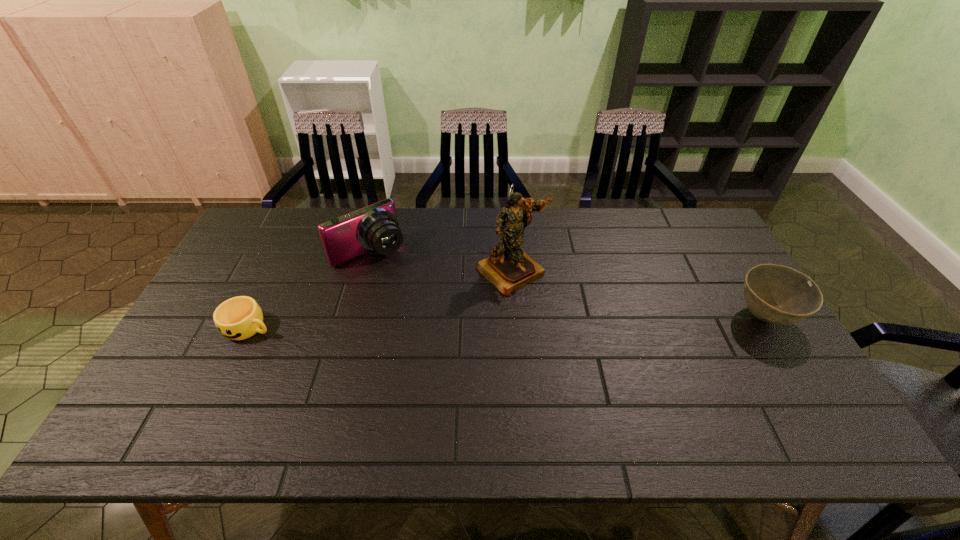
Locate an element on the screen. The height and width of the screenshot is (540, 960). the shortest object is located at coordinates (238, 318).

The width and height of the screenshot is (960, 540). I want to click on the leftmost object, so click(238, 318).

Locate an element on the screen. bowl is located at coordinates (775, 294).

Find the location of `the third tallest object`. the third tallest object is located at coordinates (775, 294).

This screenshot has width=960, height=540. What are the coordinates of `the second object from right to left` in the screenshot? It's located at (509, 268).

Where is `the tallest object`? The width and height of the screenshot is (960, 540). the tallest object is located at coordinates (509, 268).

Image resolution: width=960 pixels, height=540 pixels. Find the location of `camera`. camera is located at coordinates (375, 227).

The image size is (960, 540). Find the location of `the second object from left to right`. the second object from left to right is located at coordinates (375, 227).

The width and height of the screenshot is (960, 540). I want to click on vacant space located 0.370m on the right of the leftmost object, so click(409, 327).

Find the location of a particular element. vacant space located on the left of the bowl is located at coordinates (672, 317).